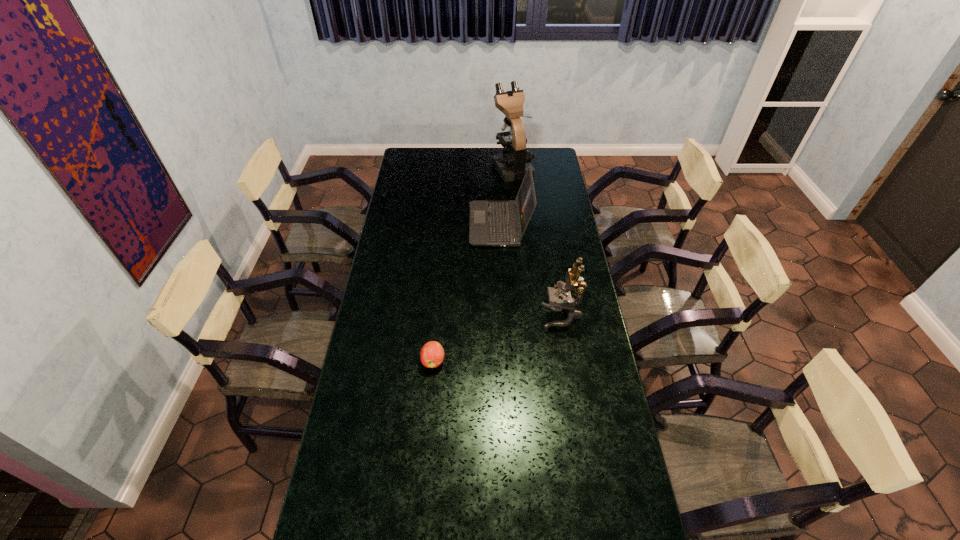
At what (x,y) coordinates should I click in order to perform the action: click on the tallest object. Please return your answer as a coordinate pair (x, y). Looking at the image, I should click on (512, 164).

The height and width of the screenshot is (540, 960). I want to click on the farthest object, so click(x=512, y=164).

Where is `the shorter microscope`? Image resolution: width=960 pixels, height=540 pixels. the shorter microscope is located at coordinates (559, 299).

Identify the location of the nearer microscope. (559, 299).

The image size is (960, 540). Find the location of `the third tallest object`. the third tallest object is located at coordinates (492, 223).

Where is `laptop_computer`? This screenshot has width=960, height=540. laptop_computer is located at coordinates (492, 223).

Find the location of a particular element. the leftmost object is located at coordinates (432, 354).

You are a GUI agent. You are given a task and a screenshot of the screen. Output one action in this format:
    pyautogui.click(x=<x>, y=<y>)
    Task: Click on the nearest object
    Image resolution: width=960 pixels, height=540 pixels.
    Given the screenshot: What is the action you would take?
    pyautogui.click(x=432, y=354)

Where is `free location located 0.160m on the left of the farther microscope`? This screenshot has width=960, height=540. free location located 0.160m on the left of the farther microscope is located at coordinates (464, 166).

In order to click on free space located at the eyepieces of the shorter microscope in this screenshot , I will do `click(511, 316)`.